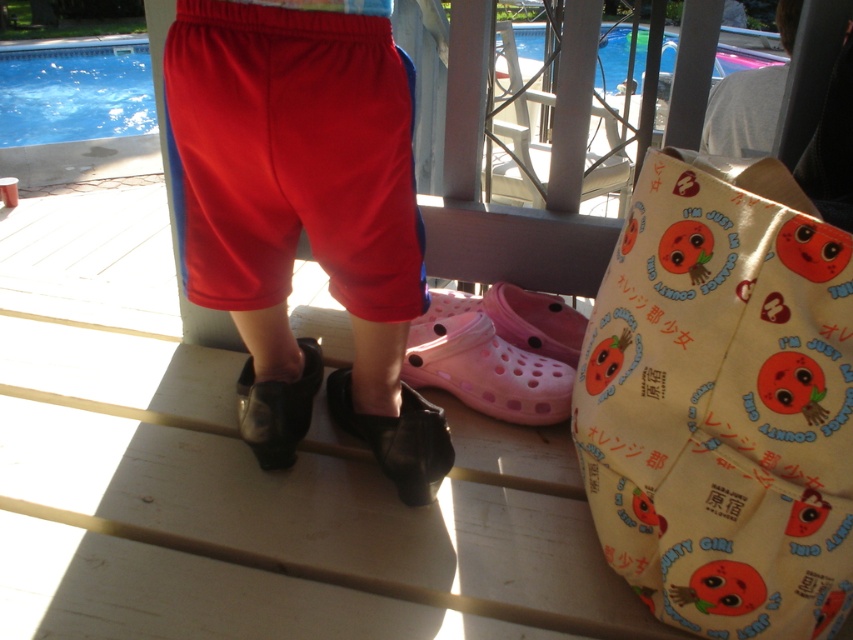
Question: From the image, what is the correct spatial relationship of pink rubber clog at center in relation to pink rubber shoe at center?

Choices:
 (A) left
 (B) right

Answer: (A)

Question: Which object is positioned farthest from the yellow paper bag at upper right?

Choices:
 (A) red matte shorts at center
 (B) pink rubber clog at center
 (C) black leather shoe at lower center

Answer: (C)

Question: Considering the real-world distances, which object is closest to the black leather shoe at center?

Choices:
 (A) blue glossy water at upper center
 (B) blue glossy water at upper left
 (C) yellow paper bag at upper right
 (D) red matte shorts at center

Answer: (D)

Question: Does yellow paper bag at upper right appear on the right side of black leather shoe at lower center?

Choices:
 (A) no
 (B) yes

Answer: (B)

Question: Is blue glossy water at upper left in front of pink rubber clog at center?

Choices:
 (A) no
 (B) yes

Answer: (A)

Question: Which point is farther to the camera?

Choices:
 (A) pink rubber clog at center
 (B) blue glossy water at upper center

Answer: (B)